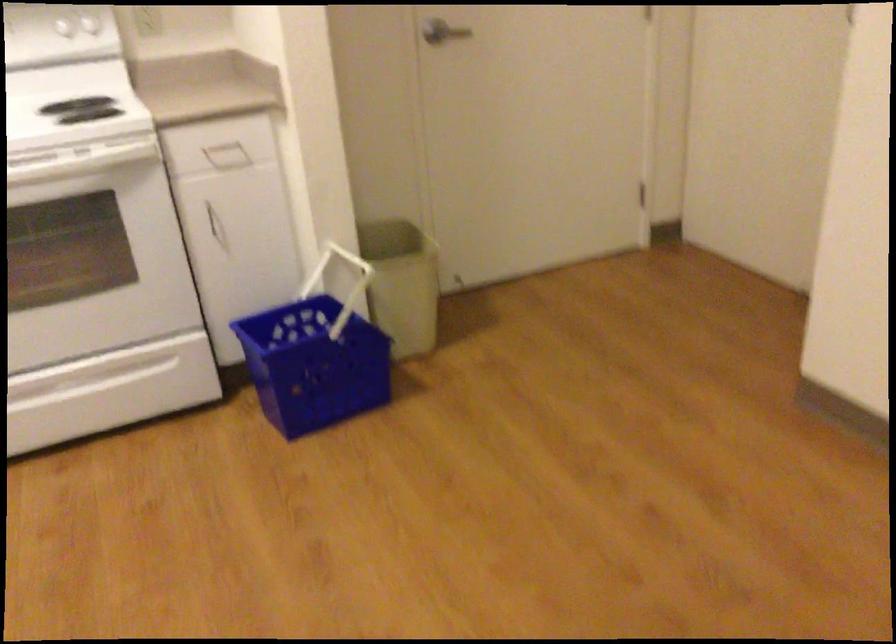
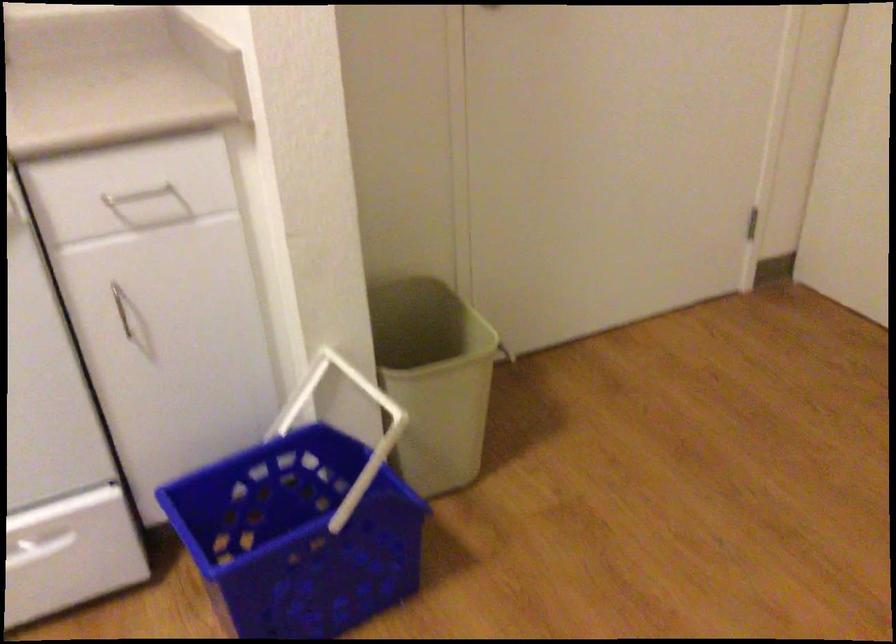
In the second image, find the point that corresponds to (207,214) in the first image.

(121, 307)